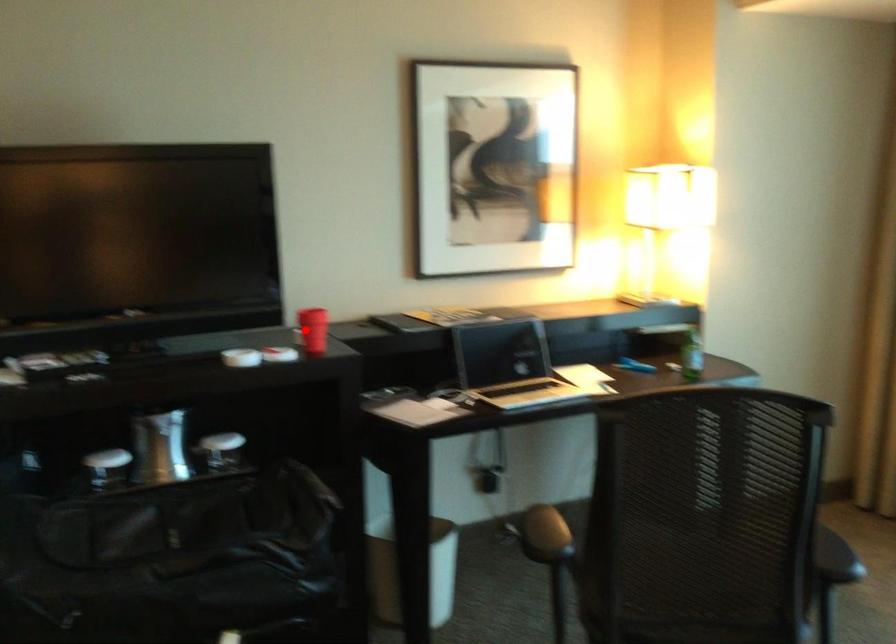
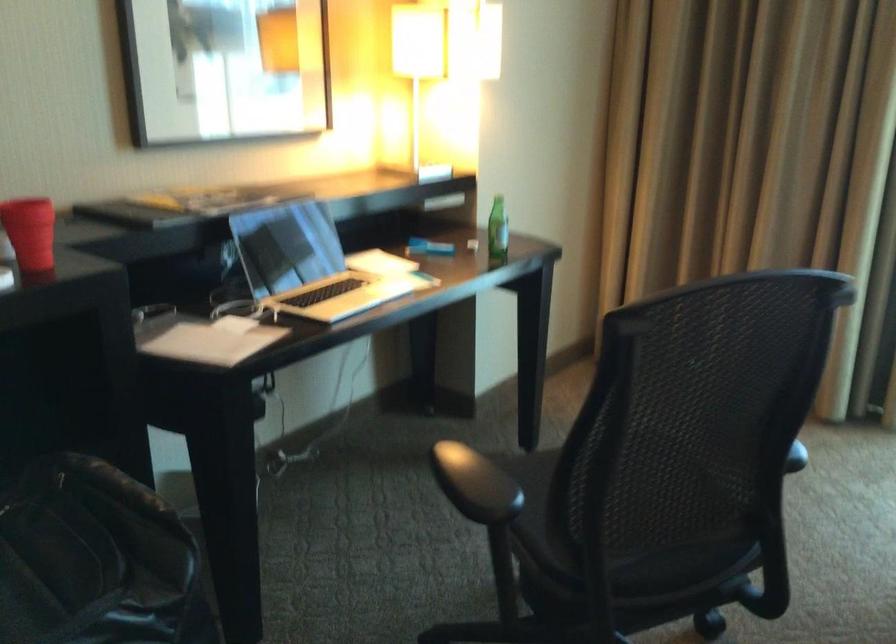
Find the pixel in the second image that matches the highlighted location in the first image.

(30, 232)